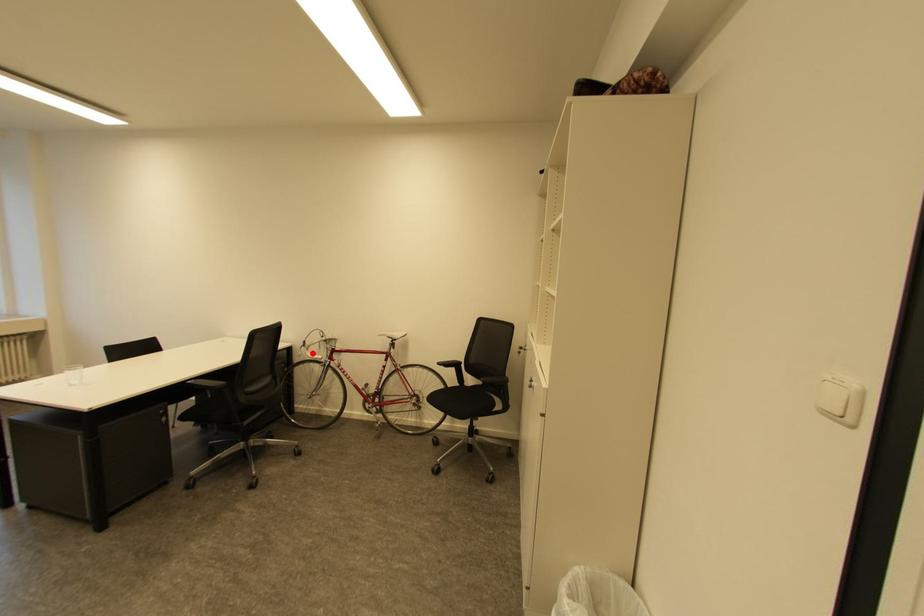
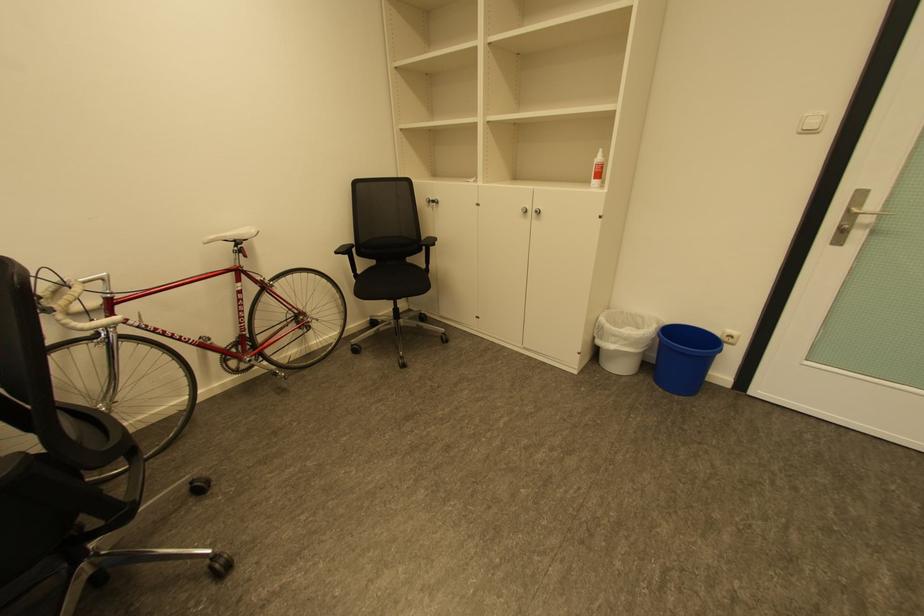
Locate, in the second image, the point that corresponds to the highlighted location in the first image.

(70, 326)